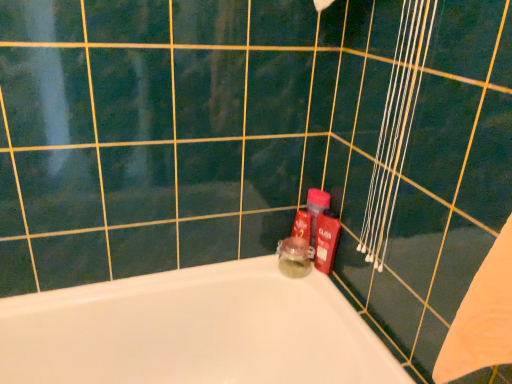
Question: Is translucent glass jar at center, acting as the 1th toiletry starting from the left, next to shiny plastic bottle at right, marked as the 2th toiletry in a left-to-right arrangement, and touching it?

Choices:
 (A) no
 (B) yes

Answer: (B)

Question: Can you confirm if translucent glass jar at center, which is the 2th toiletry from right to left, is taller than shiny plastic bottle at right, marked as the 2th toiletry in a left-to-right arrangement?

Choices:
 (A) yes
 (B) no

Answer: (B)

Question: Considering the relative sizes of translucent glass jar at center, which is the 2th toiletry from right to left, and shiny plastic bottle at right, which is the first toiletry in right-to-left order, in the image provided, is translucent glass jar at center, which is the 2th toiletry from right to left, bigger than shiny plastic bottle at right, which is the first toiletry in right-to-left order,?

Choices:
 (A) yes
 (B) no

Answer: (A)

Question: Is shiny plastic bottle at right, which is the first toiletry in right-to-left order, completely or partially inside translucent glass jar at center, acting as the 1th toiletry starting from the left?

Choices:
 (A) yes
 (B) no

Answer: (B)

Question: Considering the relative positions of translucent glass jar at center, acting as the 1th toiletry starting from the left, and shiny plastic bottle at right, marked as the 2th toiletry in a left-to-right arrangement, in the image provided, is translucent glass jar at center, acting as the 1th toiletry starting from the left, to the right of shiny plastic bottle at right, marked as the 2th toiletry in a left-to-right arrangement, from the viewer's perspective?

Choices:
 (A) no
 (B) yes

Answer: (A)

Question: Would you say translucent glass jar at center, acting as the 1th toiletry starting from the left, is outside shiny plastic bottle at right, marked as the 2th toiletry in a left-to-right arrangement?

Choices:
 (A) yes
 (B) no

Answer: (A)

Question: Considering the relative sizes of translucent glass jar at center, which is the 2th toiletry from right to left, and white glossy bathtub at lower left in the image provided, is translucent glass jar at center, which is the 2th toiletry from right to left, taller than white glossy bathtub at lower left?

Choices:
 (A) no
 (B) yes

Answer: (A)

Question: From the image's perspective, is translucent glass jar at center, acting as the 1th toiletry starting from the left, located beneath white glossy bathtub at lower left?

Choices:
 (A) no
 (B) yes

Answer: (A)

Question: Considering the relative sizes of translucent glass jar at center, acting as the 1th toiletry starting from the left, and white glossy bathtub at lower left in the image provided, is translucent glass jar at center, acting as the 1th toiletry starting from the left, thinner than white glossy bathtub at lower left?

Choices:
 (A) no
 (B) yes

Answer: (B)

Question: Does translucent glass jar at center, which is the 2th toiletry from right to left, turn towards white glossy bathtub at lower left?

Choices:
 (A) yes
 (B) no

Answer: (B)

Question: Considering the relative sizes of translucent glass jar at center, acting as the 1th toiletry starting from the left, and white glossy bathtub at lower left in the image provided, is translucent glass jar at center, acting as the 1th toiletry starting from the left, bigger than white glossy bathtub at lower left?

Choices:
 (A) yes
 (B) no

Answer: (B)

Question: From a real-world perspective, is translucent glass jar at center, acting as the 1th toiletry starting from the left, below white glossy bathtub at lower left?

Choices:
 (A) yes
 (B) no

Answer: (B)

Question: Is white glossy bathtub at lower left not close to translucent glass jar at center, acting as the 1th toiletry starting from the left?

Choices:
 (A) yes
 (B) no

Answer: (B)